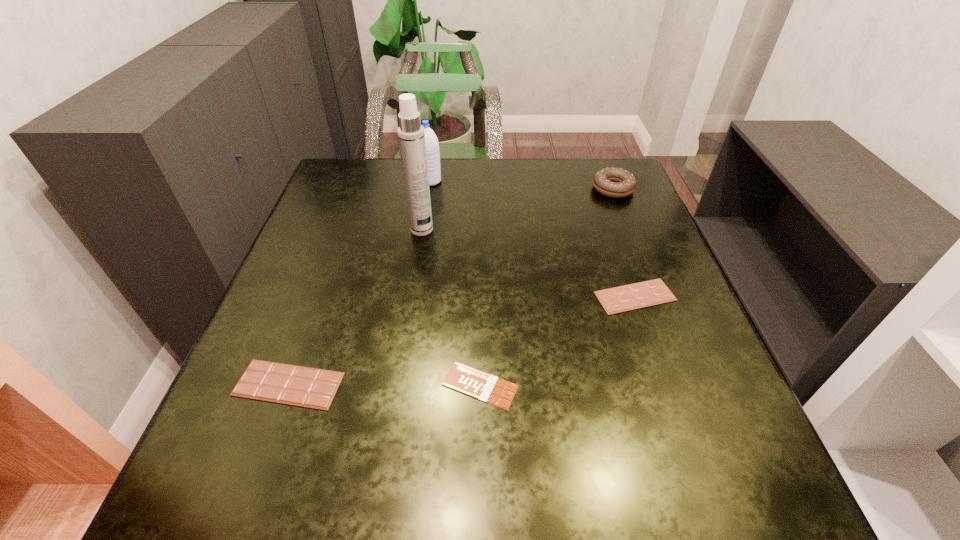
The image size is (960, 540). Identify the location of object that is at the far right corner. point(613,182).

In the image, there is a desktop. Where is `vacant space at the far edge`? This screenshot has width=960, height=540. vacant space at the far edge is located at coordinates (448, 182).

At what (x,y) coordinates should I click in order to perform the action: click on vacant area at the near edge. Please return your answer as a coordinate pair (x, y). Image resolution: width=960 pixels, height=540 pixels. Looking at the image, I should click on (444, 471).

What are the coordinates of `free space at the left edge` in the screenshot? It's located at tap(363, 225).

In the image, there is a desktop. In order to click on vacant space at the right edge in this screenshot , I will do `click(640, 251)`.

Find the location of a particular element. This screenshot has width=960, height=540. vacant space at the far left corner of the desktop is located at coordinates (347, 158).

Where is `blank space at the far right corner`? The image size is (960, 540). blank space at the far right corner is located at coordinates 577,179.

In order to click on free space between the third object from right to left and the water bottle in this screenshot , I will do (455, 283).

Locate an element on the screen. unoccupied area between the shortest chocolate bar and the rightmost chocolate bar is located at coordinates (558, 341).

Find the location of a particular element. The width and height of the screenshot is (960, 540). free space between the tallest object and the second chocolate bar from left to right is located at coordinates (451, 307).